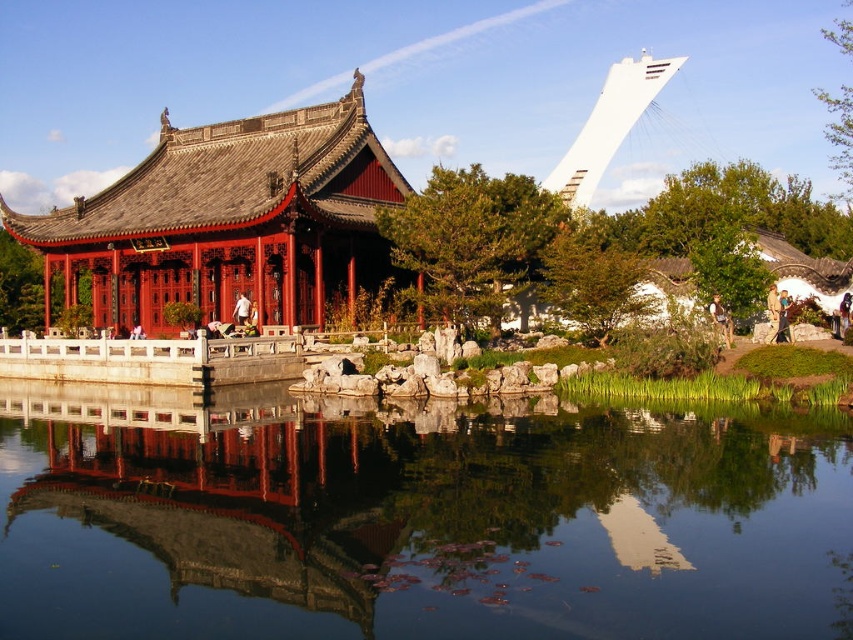
Question: Is transparent glass water at center behind matte red wood palace at left?

Choices:
 (A) yes
 (B) no

Answer: (B)

Question: Is transparent glass water at center bigger than matte red wood palace at left?

Choices:
 (A) yes
 (B) no

Answer: (B)

Question: Considering the relative positions of transparent glass water at center and matte red wood palace at left in the image provided, where is transparent glass water at center located with respect to matte red wood palace at left?

Choices:
 (A) below
 (B) above

Answer: (A)

Question: Which point appears closest to the camera in this image?

Choices:
 (A) [x=408, y=465]
 (B) [x=79, y=209]

Answer: (A)